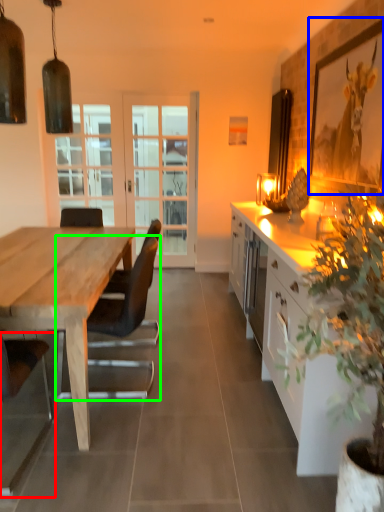
Question: Which is farther away from chair (highlighted by a red box)? picture frame (highlighted by a blue box) or chair (highlighted by a green box)?

Choices:
 (A) picture frame
 (B) chair

Answer: (A)